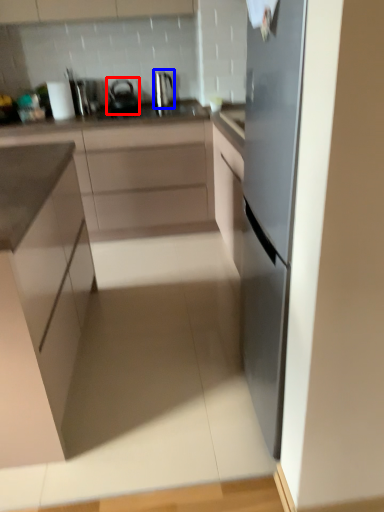
Question: Which of the following is the closest to the observer, tea pot (highlighted by a red box) or kitchen appliance (highlighted by a blue box)?

Choices:
 (A) tea pot
 (B) kitchen appliance

Answer: (A)